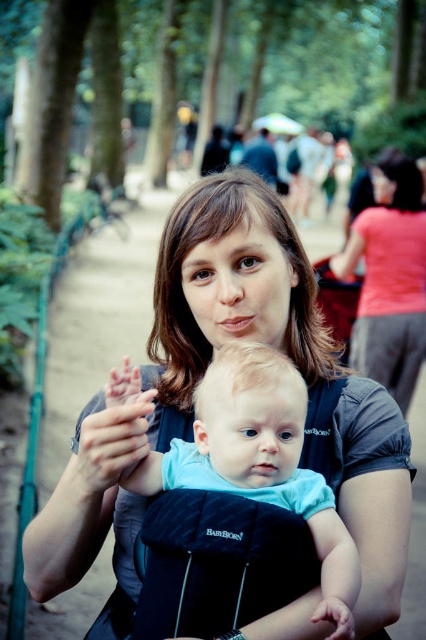
From the picture: You are a photographer standing 5 feet away from the woman. You want to take a photo that captures both the matte gray shirt at center and the matte skin hand at center clearly. Given that your camera has a minimum focus distance of 12 inches, will you be able to focus on both objects simultaneously?

The distance between the matte gray shirt at center and the matte skin hand at center is 10.00 inches. Since your camera requires a minimum focus distance of 12 inches, the 10.00 inch gap is shorter than the required distance. Therefore, the camera may not be able to focus on both objects simultaneously as they are too close together.

You are standing at point (120, 509) and want to take a photo of the woman and baby. The camera you have is 1.2 meters in height. Can you see the camera from your current position?

The distance between point (120, 509) and the camera is 1.35 meters. Since the camera is 1.2 meters in height, you can see the camera from your current position as long as there are no obstructions.